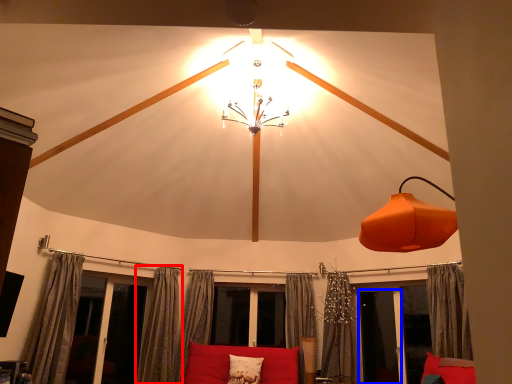
Question: Which object appears farthest to the camera in this image, curtain (highlighted by a red box) or screen door (highlighted by a blue box)?

Choices:
 (A) curtain
 (B) screen door

Answer: (B)